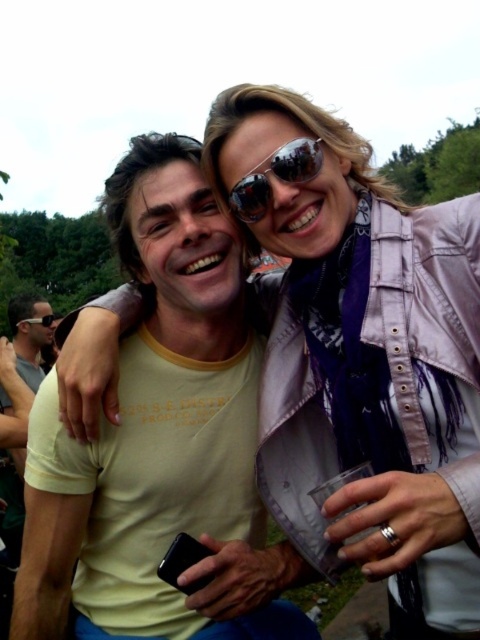
Question: Which of the following is the farthest from the observer?

Choices:
 (A) (23, 372)
 (B) (26, 320)

Answer: (B)

Question: Is matte black sunglasses at upper left smaller than black reflective sunglasses at upper center?

Choices:
 (A) yes
 (B) no

Answer: (B)

Question: Observing the image, what is the correct spatial positioning of sunglasses at center in reference to black reflective sunglasses at upper center?

Choices:
 (A) left
 (B) right

Answer: (B)

Question: Which point appears farthest from the camera in this image?

Choices:
 (A) (38, 339)
 (B) (54, 314)
 (C) (240, 188)
 (D) (248, 468)

Answer: (B)

Question: Does yellow cotton t-shirt at center have a greater width compared to matte black sunglasses at upper left?

Choices:
 (A) no
 (B) yes

Answer: (A)

Question: Which object is farther from the camera taking this photo?

Choices:
 (A) matte black sunglasses at upper left
 (B) yellow cotton t-shirt at center
 (C) sunglasses at center
 (D) black reflective sunglasses at upper center

Answer: (D)